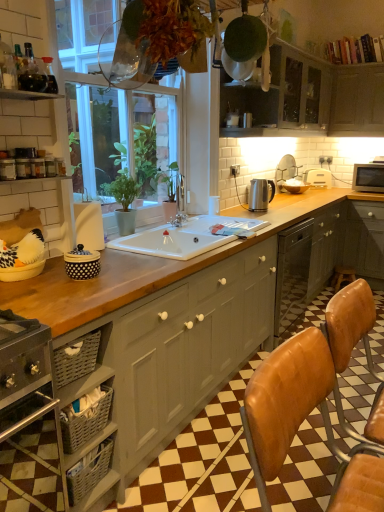
Identify the location of free spot behind polka dot ceramic jar at left, the 1th appliance viewed from the left. Image resolution: width=384 pixels, height=512 pixels. (112, 259).